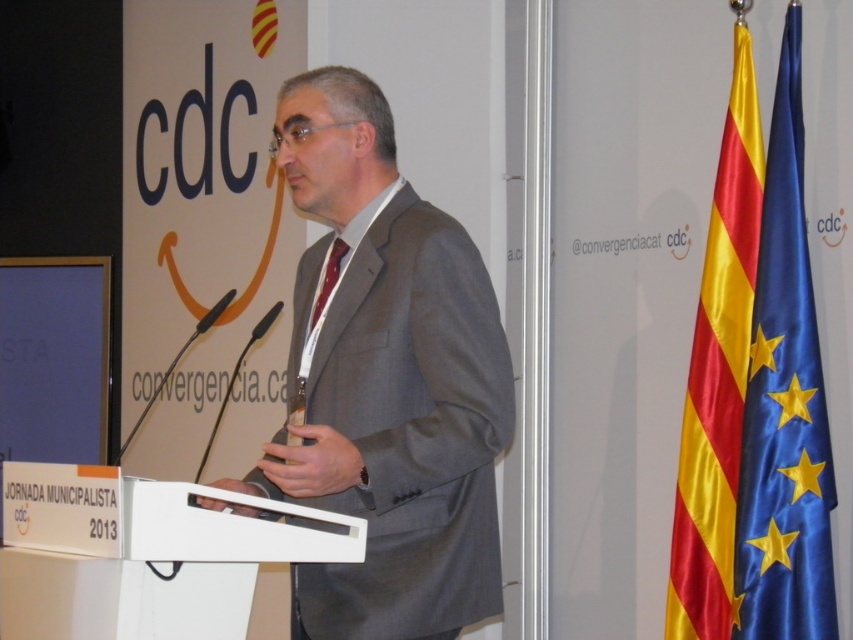
Question: Which of the following is the closest to the observer?

Choices:
 (A) blue fabric flag at right
 (B) gray suit at center

Answer: (B)

Question: Which is nearer to the matte red tie at center?

Choices:
 (A) blue fabric flag at right
 (B) gray suit at center
 (C) yellow/red striped fabric flag at right

Answer: (B)

Question: Does gray suit at center have a larger size compared to blue fabric flag at right?

Choices:
 (A) yes
 (B) no

Answer: (A)

Question: Which object is positioned farthest from the gray suit at center?

Choices:
 (A) yellow/red striped fabric flag at right
 (B) matte red tie at center
 (C) blue fabric flag at right

Answer: (A)

Question: Can you confirm if yellow/red striped fabric flag at right is smaller than matte red tie at center?

Choices:
 (A) yes
 (B) no

Answer: (B)

Question: Is blue fabric flag at right wider than matte red tie at center?

Choices:
 (A) yes
 (B) no

Answer: (A)